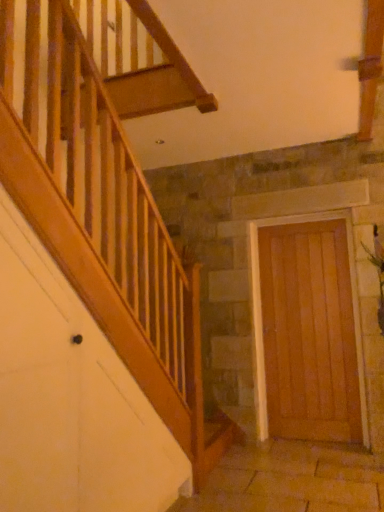
Question: From a real-world perspective, is green leafy plant at right located beneath wooden door at right?

Choices:
 (A) no
 (B) yes

Answer: (A)

Question: Would you say green leafy plant at right is a long distance from wooden door at right?

Choices:
 (A) no
 (B) yes

Answer: (A)

Question: Is green leafy plant at right touching wooden door at right?

Choices:
 (A) yes
 (B) no

Answer: (B)

Question: Is wooden door at right at the back of green leafy plant at right?

Choices:
 (A) no
 (B) yes

Answer: (A)

Question: From the image's perspective, does green leafy plant at right appear higher than wooden door at right?

Choices:
 (A) no
 (B) yes

Answer: (B)

Question: Can you confirm if green leafy plant at right is positioned to the left of wooden door at right?

Choices:
 (A) no
 (B) yes

Answer: (A)

Question: Considering the relative positions of wooden door at right and green leafy plant at right in the image provided, is wooden door at right in front of green leafy plant at right?

Choices:
 (A) no
 (B) yes

Answer: (A)

Question: From a real-world perspective, is wooden door at right positioned over green leafy plant at right based on gravity?

Choices:
 (A) no
 (B) yes

Answer: (A)

Question: From the image's perspective, is wooden door at right beneath green leafy plant at right?

Choices:
 (A) yes
 (B) no

Answer: (A)

Question: Can you confirm if wooden door at right is positioned to the right of green leafy plant at right?

Choices:
 (A) yes
 (B) no

Answer: (B)

Question: From the image's perspective, does wooden door at right appear higher than green leafy plant at right?

Choices:
 (A) yes
 (B) no

Answer: (B)

Question: Can green leafy plant at right be found inside wooden door at right?

Choices:
 (A) no
 (B) yes

Answer: (A)

Question: Visually, is green leafy plant at right positioned to the left or to the right of wooden door at right?

Choices:
 (A) right
 (B) left

Answer: (A)